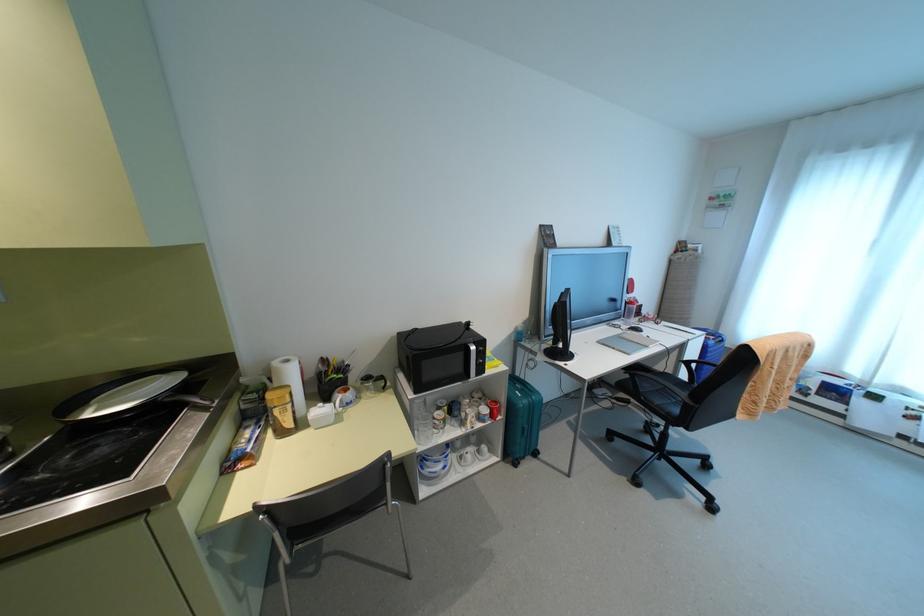
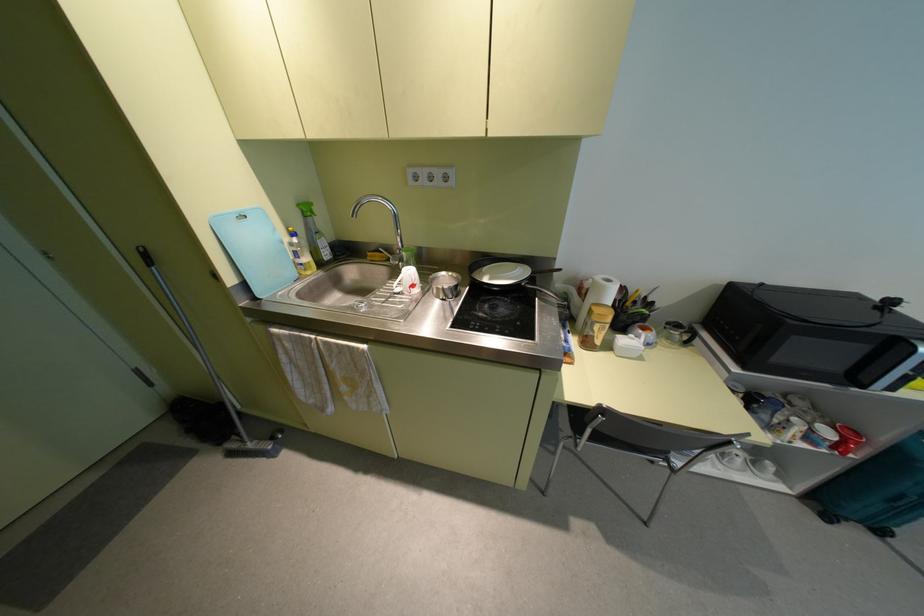
In the second image, find the point that corresponds to (535,454) in the first image.

(880, 531)